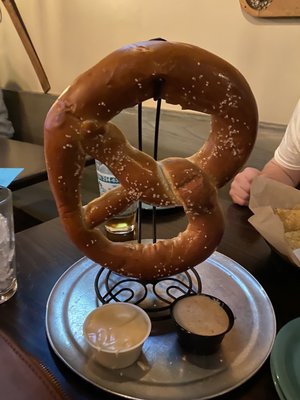
Locate an element on the screen. The height and width of the screenshot is (400, 300). dish is located at coordinates (246, 303).